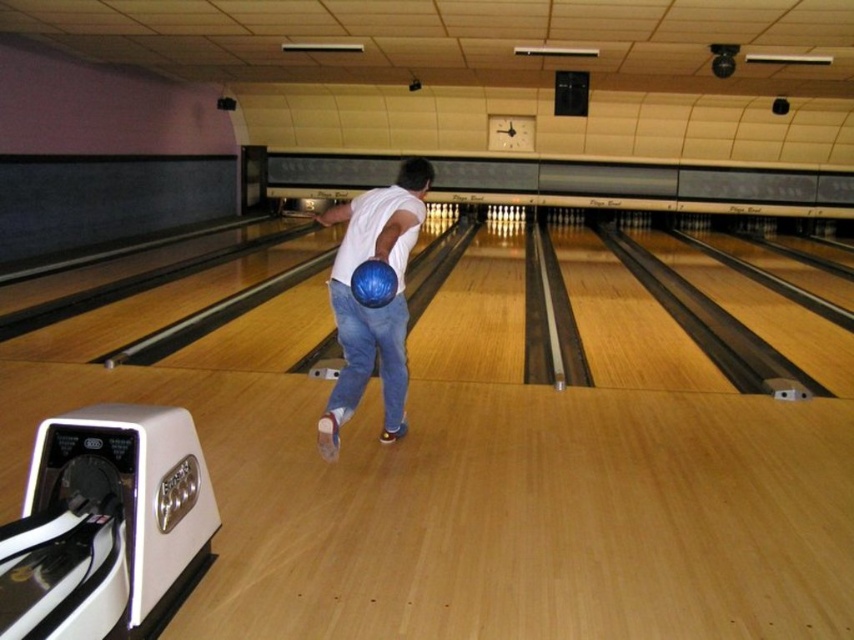
Which of these two, blue matte bowling ball at center or blue denim jeans at center, stands shorter?

blue denim jeans at center is shorter.

Identify the location of blue matte bowling ball at center. (373, 308).

At what (x,y) coordinates should I click in order to perform the action: click on blue matte bowling ball at center. Please return your answer as a coordinate pair (x, y). This screenshot has height=640, width=854. Looking at the image, I should click on (373, 308).

The image size is (854, 640). In order to click on blue matte bowling ball at center in this screenshot , I will do `click(373, 308)`.

Is the position of blue denim jeans at center less distant than that of blue rubber bowling ball at center?

No, it is behind blue rubber bowling ball at center.

Can you confirm if blue denim jeans at center is positioned to the right of blue rubber bowling ball at center?

No, blue denim jeans at center is not to the right of blue rubber bowling ball at center.

Between point (355, 305) and point (392, 296), which one is positioned in front?

Point (392, 296)

This screenshot has width=854, height=640. Find the location of `blue denim jeans at center`. blue denim jeans at center is located at coordinates (369, 356).

Consider the image. Is blue matte bowling ball at center positioned at the back of blue rubber bowling ball at center?

Yes, blue matte bowling ball at center is further from the viewer.

Does blue matte bowling ball at center have a larger size compared to blue rubber bowling ball at center?

Correct, blue matte bowling ball at center is larger in size than blue rubber bowling ball at center.

Which is behind, point (381, 374) or point (367, 262)?

Point (381, 374)

You are a GUI agent. You are given a task and a screenshot of the screen. Output one action in this format:
    pyautogui.click(x=<x>, y=<y>)
    Task: Click on the blue matte bowling ball at center
    The image size is (854, 640).
    Given the screenshot: What is the action you would take?
    pyautogui.click(x=373, y=308)